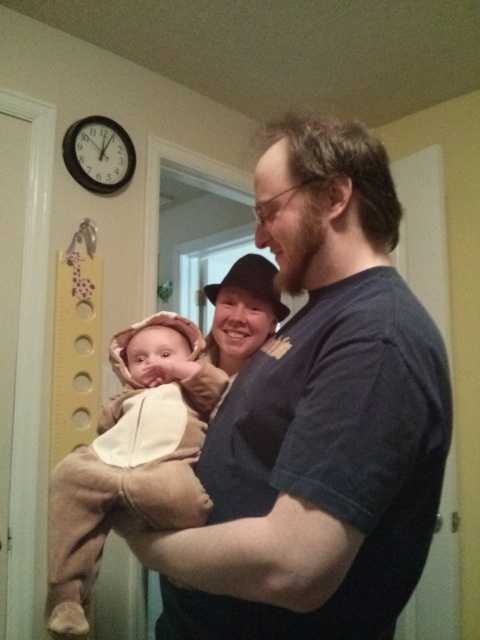
You are a photographer trying to capture a candid shot of the black plastic clock at upper left without including the soft beige costume at center in the frame. Is this possible given their positions?

The soft beige costume at center is in front of the black plastic clock at upper left, so it would block the view of the clock. Therefore, capturing the clock without the costume in the frame is not possible.

You are a photographer trying to capture the baby in the beige outfit with a hood. The camera you are using has a focus point at coordinate point [131,465]. Will this focus point land on the baby?

The point [131,465] is where the soft beige costume at center is located, so yes, the focus point will land on the baby in the beige outfit with a hood.